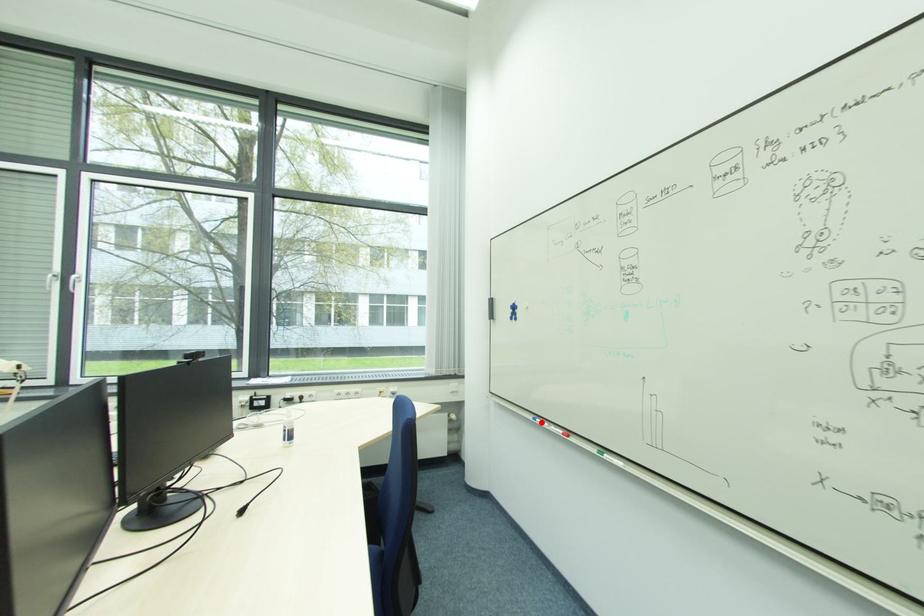
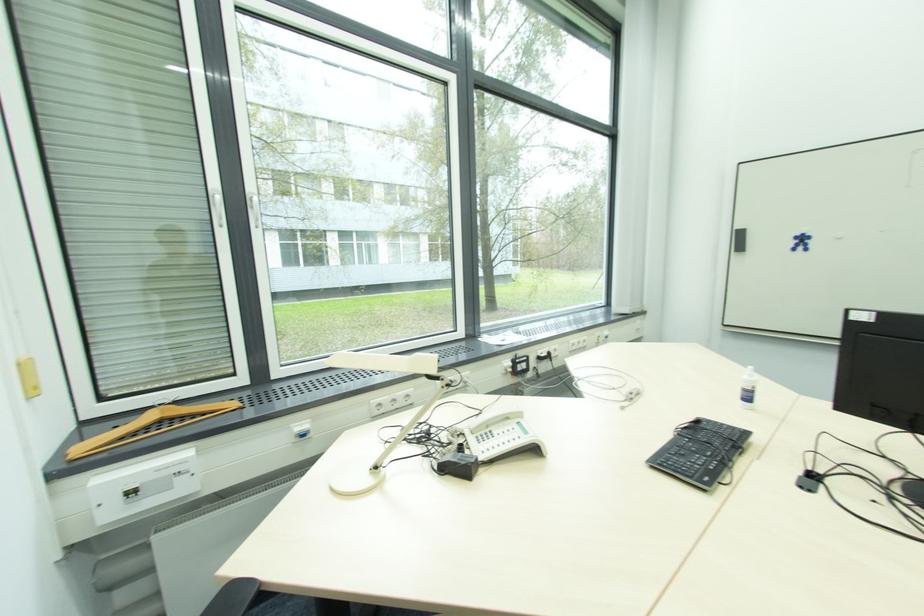
Question: I am providing you with two images of the same scene from different viewpoints. A red point is marked on the first image. Can you still see the location of the red point in image 2?

Choices:
 (A) Yes
 (B) No

Answer: (B)